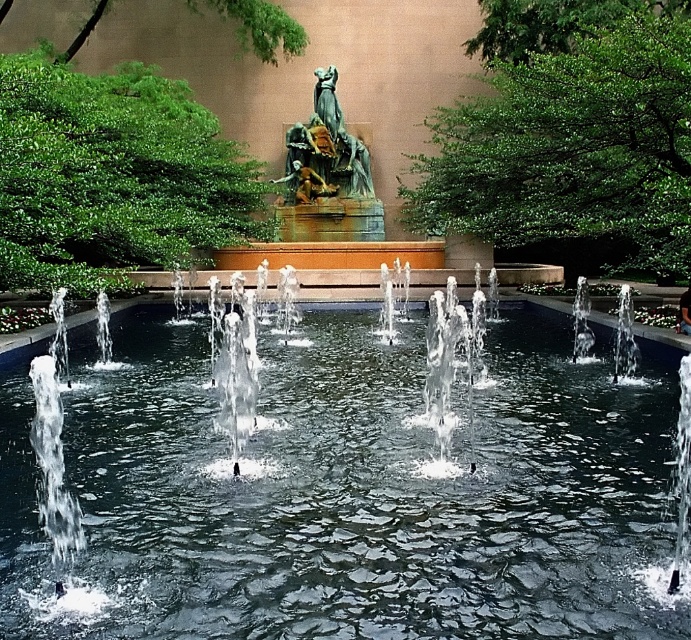
How much distance is there between clear water at center and bronze statue at center?

23.42 meters

Is point (416, 561) closer to viewer compared to point (319, 113)?

Yes, point (416, 561) is closer to viewer.

You are a GUI agent. You are given a task and a screenshot of the screen. Output one action in this format:
    pyautogui.click(x=<x>, y=<y>)
    Task: Click on the clear water at center
    
    Given the screenshot: What is the action you would take?
    pyautogui.click(x=346, y=492)